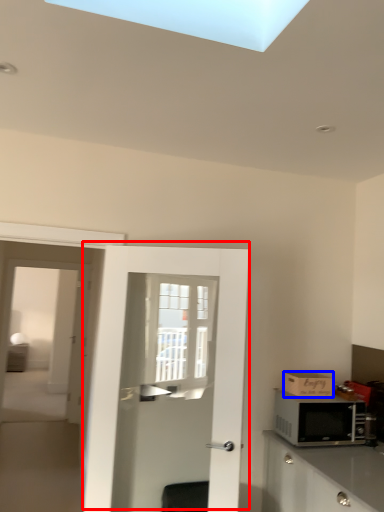
Question: Which object is further to the camera taking this photo, door (highlighted by a red box) or cardboard box (highlighted by a blue box)?

Choices:
 (A) door
 (B) cardboard box

Answer: (B)